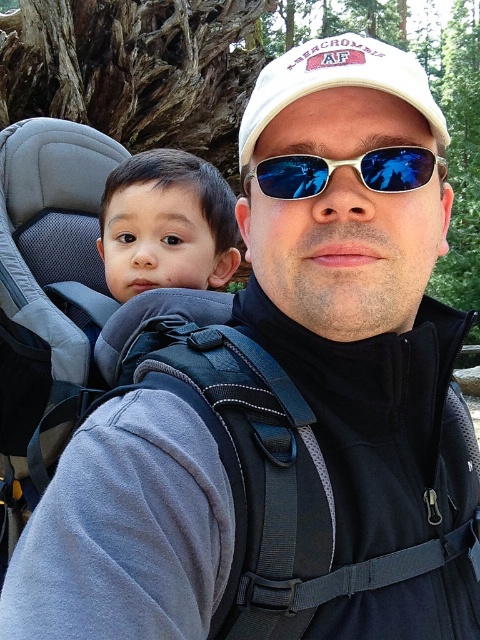
Question: Which point appears closest to the camera in this image?

Choices:
 (A) tap(424, 513)
 (B) tap(186, 243)
 (C) tap(260, 163)

Answer: (A)

Question: Can you confirm if black fabric strap at center is bigger than blue reflective plastic sunglasses at center?

Choices:
 (A) no
 (B) yes

Answer: (B)

Question: Is smooth skin baby at center behind blue reflective plastic sunglasses at center?

Choices:
 (A) yes
 (B) no

Answer: (A)

Question: Considering the real-world distances, which object is farthest from the smooth skin baby at center?

Choices:
 (A) black fabric strap at center
 (B) blue reflective plastic sunglasses at center

Answer: (A)

Question: Where is black fabric strap at center located in relation to blue reflective plastic sunglasses at center in the image?

Choices:
 (A) above
 (B) below

Answer: (B)

Question: Which of the following is the farthest from the observer?

Choices:
 (A) (228, 269)
 (B) (432, 168)

Answer: (A)